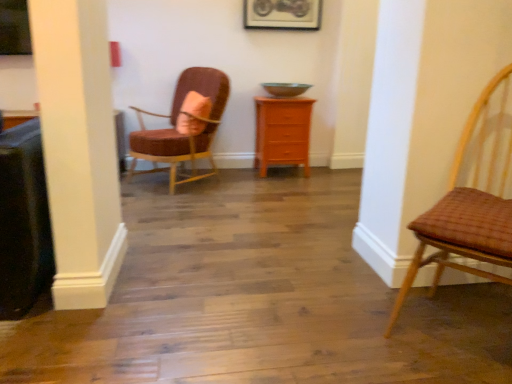
Question: Is pink fabric pillow at center turned away from orange wood chest of drawers at center?

Choices:
 (A) no
 (B) yes

Answer: (B)

Question: From a real-world perspective, is pink fabric pillow at center positioned over orange wood chest of drawers at center based on gravity?

Choices:
 (A) no
 (B) yes

Answer: (B)

Question: From the image's perspective, is pink fabric pillow at center on top of orange wood chest of drawers at center?

Choices:
 (A) yes
 (B) no

Answer: (A)

Question: From the image's perspective, is pink fabric pillow at center under orange wood chest of drawers at center?

Choices:
 (A) yes
 (B) no

Answer: (B)

Question: Is pink fabric pillow at center bigger than orange wood chest of drawers at center?

Choices:
 (A) no
 (B) yes

Answer: (A)

Question: Is pink fabric pillow at center taller than orange wood chest of drawers at center?

Choices:
 (A) no
 (B) yes

Answer: (A)

Question: Is the depth of woven brown chair at right, the second chair viewed from the back, less than that of velvet pink chair at upper left, the first chair from the left?

Choices:
 (A) yes
 (B) no

Answer: (A)

Question: Can you confirm if woven brown chair at right, the second chair viewed from the back, is shorter than velvet pink chair at upper left, which is the second chair from right to left?

Choices:
 (A) yes
 (B) no

Answer: (B)

Question: From a real-world perspective, does woven brown chair at right, the 2th chair when ordered from left to right, sit lower than velvet pink chair at upper left, which ranks as the first chair in back-to-front order?

Choices:
 (A) no
 (B) yes

Answer: (A)

Question: Is woven brown chair at right, the 2th chair when ordered from left to right, at the right side of velvet pink chair at upper left, which ranks as the first chair in back-to-front order?

Choices:
 (A) no
 (B) yes

Answer: (B)

Question: From the image's perspective, is woven brown chair at right, the second chair viewed from the back, beneath velvet pink chair at upper left, the second chair when ordered from front to back?

Choices:
 (A) yes
 (B) no

Answer: (A)

Question: From the image's perspective, is woven brown chair at right, the second chair viewed from the back, over velvet pink chair at upper left, which ranks as the first chair in back-to-front order?

Choices:
 (A) no
 (B) yes

Answer: (A)

Question: Considering the relative positions of orange wood chest of drawers at center and woven brown chair at right, the first chair when ordered from front to back, in the image provided, is orange wood chest of drawers at center to the left of woven brown chair at right, the first chair when ordered from front to back, from the viewer's perspective?

Choices:
 (A) yes
 (B) no

Answer: (A)